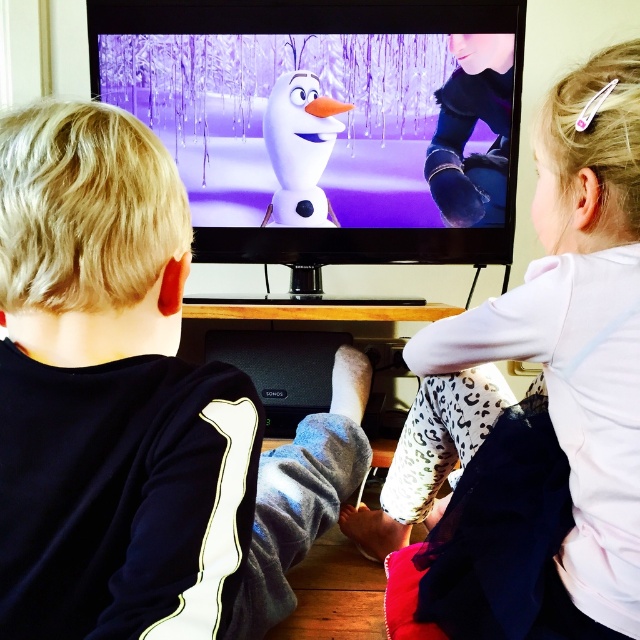
You are a parent trying to arrange two snowman toys on a shelf. The shelf has a width of 1 meter. You have the white matte snowman at center and the matte white snowman at center. Which snowman will occupy more space on the shelf?

The white matte snowman at center has a larger width than the matte white snowman at center, so it will occupy more space on the shelf.

You are a parent trying to take a photo of your children and the animated characters on the TV. You want to ensure both the black fleece shirt at left and the white matte snowman at center are clearly visible in the shot. Which object should you focus on first to make sure both are in focus?

You should focus on the black fleece shirt at left first because it is closer to the viewer than the white matte snowman at center. By focusing on the closer object, the snowman will still be in focus due to the depth of field extending beyond the focal point.

Looking at this image, you are a toy delivery robot entering the living room. You need to place a new snowman toy in front of the white leopard print pants at lower right. Can you safely place it there without blocking the view of the white matte snowman at center?

The white leopard print pants at lower right is closer to the viewer than the white matte snowman at center. Since the leopard print pants are closer, placing the snowman toy in front of them would position it even closer, potentially blocking the view of the existing white matte snowman at center. Therefore, placing the new snowman toy in front of the white leopard print pants at lower right might block the view of the white matte snowman at center.